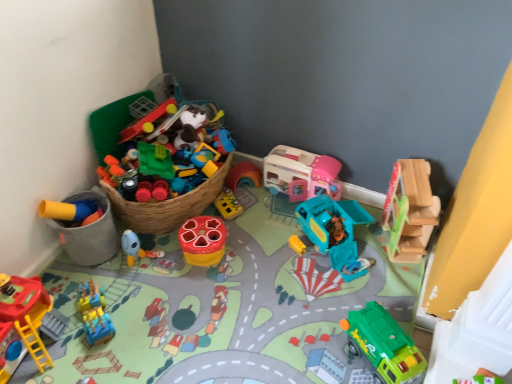
Locate an element on the screen. The image size is (512, 384). vacant space to the right of rubberized plastic toy at center, positioned as the fourth toy in left-to-right order is located at coordinates (252, 248).